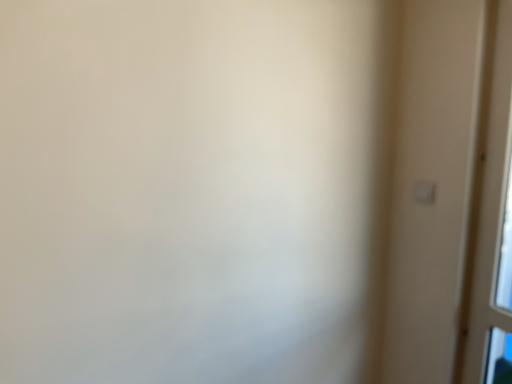
The width and height of the screenshot is (512, 384). Find the location of `transparent glass screen door at right`. transparent glass screen door at right is located at coordinates point(490,218).

Describe the element at coordinates (490, 218) in the screenshot. I see `transparent glass screen door at right` at that location.

What is the approximate width of transparent glass screen door at right?

The width of transparent glass screen door at right is 8.86 centimeters.

Image resolution: width=512 pixels, height=384 pixels. Find the location of `transparent glass screen door at right`. transparent glass screen door at right is located at coordinates (490, 218).